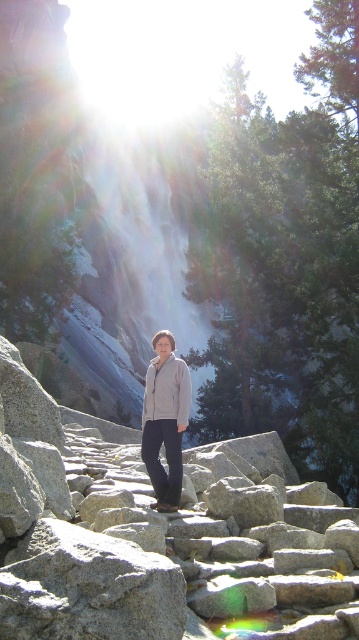
You are a hiker who wants to sit down for a rest. You see the smooth granite rocks at center and the light gray fleece sweatshirt at center. Which one is a better option to sit on?

The smooth granite rocks at center is larger in size than the light gray fleece sweatshirt at center, so it would be a better option to sit on as it provides a more stable and comfortable surface.

You are a photographer planning to take a picture of the smooth granite rocks at center in the mountainous landscape. The camera you are using has a focal length of 50mm and an aperture of f2.8. Based on the given coordinates, can you determine if the rocks will be in the center of the frame?

The smooth granite rocks at center are located at coordinates point (160, 534), which means they are slightly to the right and above the exact center of the frame. Therefore, they will not be perfectly centered in the photograph.

You are a photographer trying to capture the light gray fleece jacket at center in the image. The smooth granite rocks at center are blocking your view. Can you move the rocks to get a clear shot of the jacket?

The smooth granite rocks at center is much taller than the light gray fleece jacket at center, so moving the rocks would be necessary to get a clear view of the jacket since the rocks are taller and blocking the jacket.